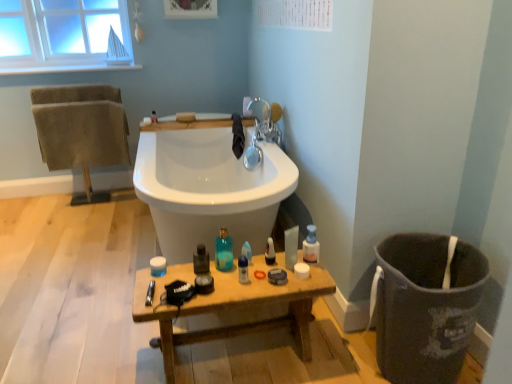
Identify the location of vacant space that is to the left of translucent plastic spray bottle at center, arranged as the 2th cleaning product when viewed from the left. click(x=241, y=267).